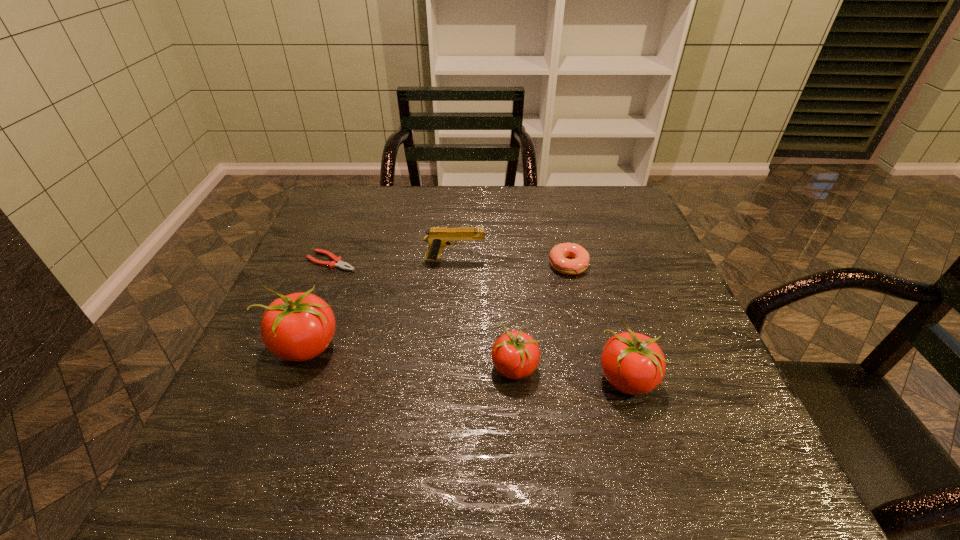
At what (x,y) coordinates should I click in order to perform the action: click on vacant point located 0.130m on the right of the rightmost tomato. Please return your answer as a coordinate pair (x, y). Looking at the image, I should click on (722, 379).

This screenshot has width=960, height=540. In order to click on vacant space situated 0.110m on the front of the shortest object in this screenshot , I will do (315, 303).

At what (x,y) coordinates should I click in order to perform the action: click on vacant space located on the front of the second shortest object. Please return your answer as a coordinate pair (x, y). Looking at the image, I should click on (592, 366).

Where is `vacant space located 0.160m at the barrel of the fourth object from right to left`? The image size is (960, 540). vacant space located 0.160m at the barrel of the fourth object from right to left is located at coordinates [546, 260].

This screenshot has height=540, width=960. I want to click on object located in the near edge section of the desktop, so click(x=633, y=363).

Where is `tomato present at the left edge`? tomato present at the left edge is located at coordinates (298, 327).

Where is `pliers situated at the left edge`? The width and height of the screenshot is (960, 540). pliers situated at the left edge is located at coordinates (337, 261).

This screenshot has height=540, width=960. I want to click on object that is at the right edge, so click(633, 363).

Where is `object that is at the near right corner`? The image size is (960, 540). object that is at the near right corner is located at coordinates pos(633,363).

Find the location of `vacant space at the far edge of the desktop`. vacant space at the far edge of the desktop is located at coordinates (404, 198).